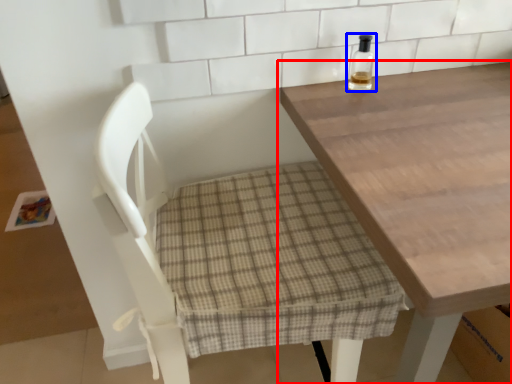
Question: Which object appears farthest to the camera in this image, table (highlighted by a red box) or bottle (highlighted by a blue box)?

Choices:
 (A) table
 (B) bottle

Answer: (B)